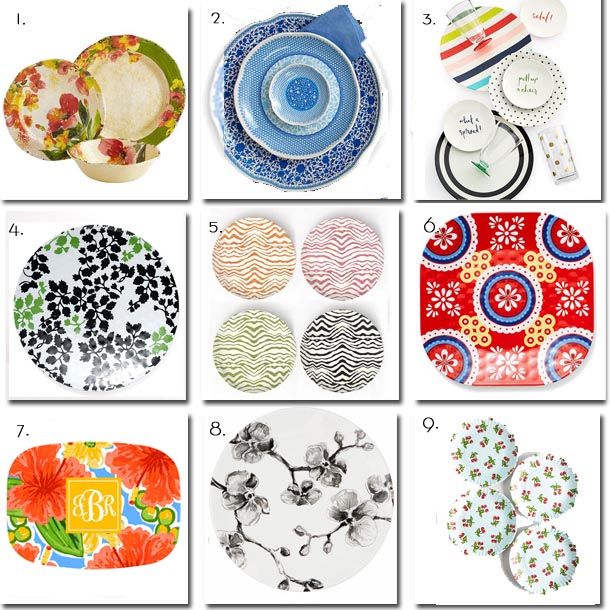
Find the location of a particular element. The height and width of the screenshot is (610, 610). smaller serving bowl in dark and light blue is located at coordinates (301, 106).